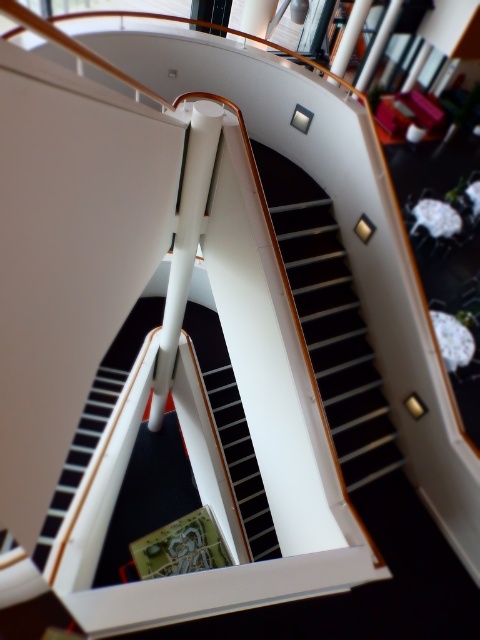
Based on the photo, you are standing at the top of the staircase and want to walk down to the lower level. Which stair should you step onto first, the wooden stair at center or the black glossy stair at center?

You should step onto the wooden stair at center first because it is positioned over the black glossy stair at center, making it the upper step in the staircase.

You are standing at the top of a staircase and want to walk down to the bottom. The wooden stair at center is 6.03 meters away from you. If your average step length is 0.75 meters, how many steps will you need to take to reach the bottom?

The wooden stair at center is 6.03 meters away from the viewer. Dividing the total distance by the step length gives 6.03 divided by 0.75, which equals approximately 8.04 steps. Since you can only take whole steps, you would need to take 8 full steps to reach the bottom.

You are an architect designing a new building and are considering the placement of two different types of stairs in the central area. You have a wooden stair at center and a black glossy stair at center. Based on the image provided, which stair would require more floor space due to its size?

The wooden stair at center is larger in size than the black glossy stair at center, so it would require more floor space.